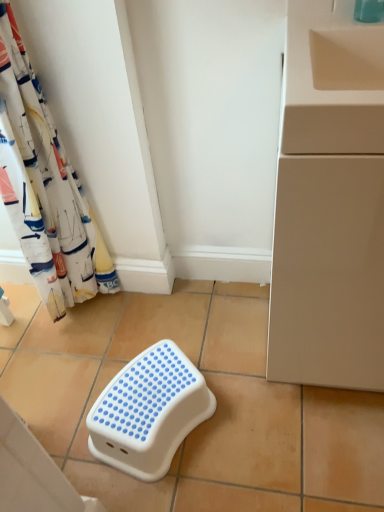
Locate an element on the screen. free area in between beige matte cabinet at right and white plastic step stool at center is located at coordinates (251, 389).